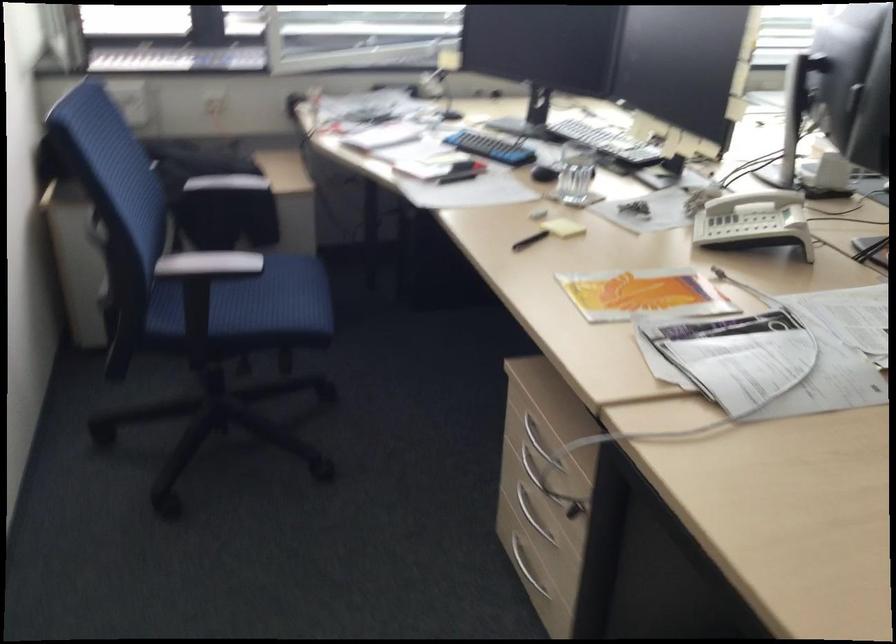
Find where to press the telephone button. Please return your answer as a coordinate pair (x, y).

(751, 225)